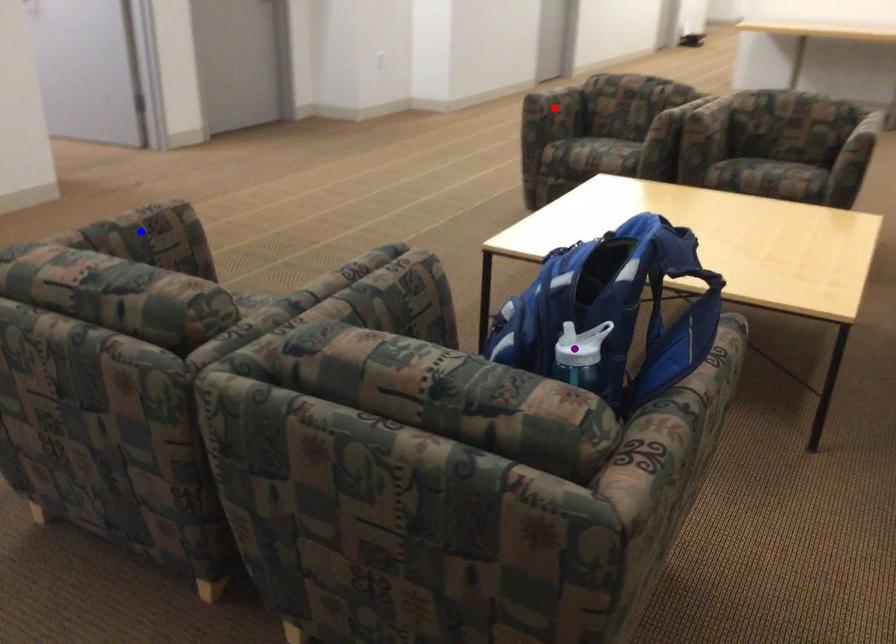
Order these from nearest to farthest:
- red point
- blue point
- purple point

1. purple point
2. blue point
3. red point